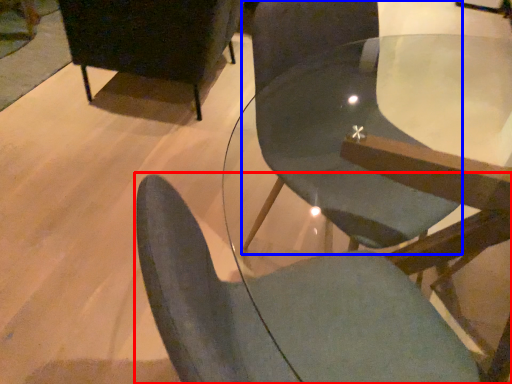
Question: Which object is closer to the camera taking this photo, chair (highlighted by a red box) or chair (highlighted by a blue box)?

Choices:
 (A) chair
 (B) chair

Answer: (A)